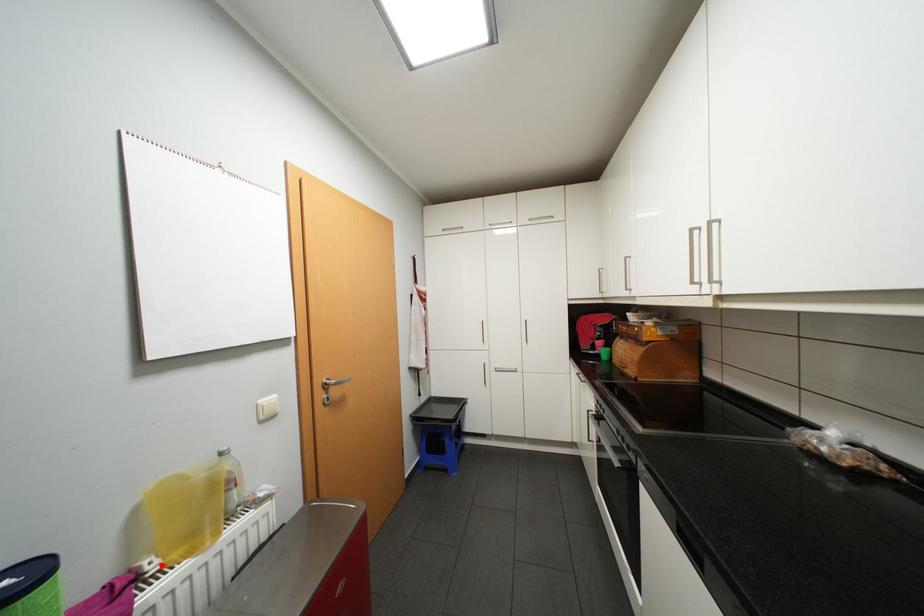
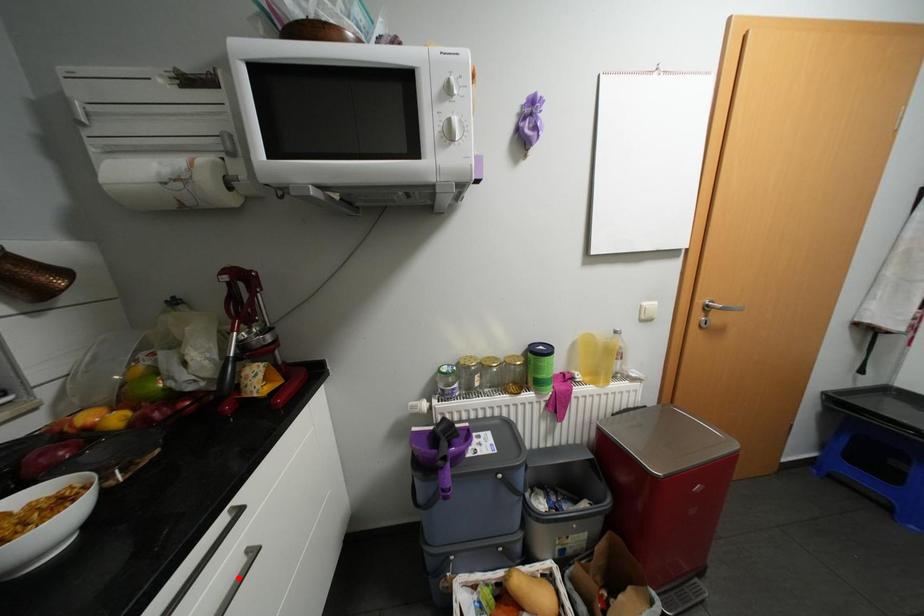
I am providing you with two images of the same scene from different viewpoints. A red point is marked on the first image and another point is marked on the second image. Is the red point in image1 aligned with the point shown in image2?

No